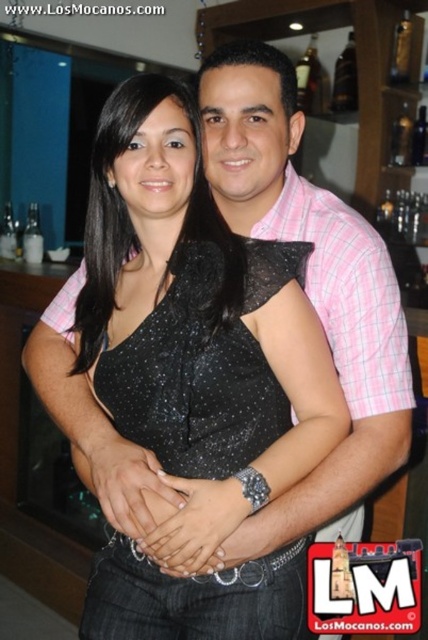
Who is more distant from viewer, (270, 435) or (297, 88)?

The point (297, 88) is more distant.

Can you confirm if black sequined dress at center is smaller than dark brown glass bottle at upper center?

Incorrect, black sequined dress at center is not smaller in size than dark brown glass bottle at upper center.

Which is behind, point (204, 204) or point (314, 104)?

The point (314, 104) is more distant.

Locate an element on the screen. The image size is (428, 640). black sequined dress at center is located at coordinates (199, 324).

Between point (308, 248) and point (347, 100), which one is positioned in front?

Point (308, 248) is more forward.

Which is more to the left, black sequined dress at center or shiny glass bottle at upper right?

Positioned to the left is black sequined dress at center.

Describe the element at coordinates (199, 324) in the screenshot. I see `black sequined dress at center` at that location.

This screenshot has height=640, width=428. Identify the location of black sequined dress at center. (199, 324).

Is dark brown glass bottle at upper center smaller than shiny glass bottle at upper right?

No.

Between dark brown glass bottle at upper center and shiny glass bottle at upper right, which one has more height?

With more height is dark brown glass bottle at upper center.

Identify the location of dark brown glass bottle at upper center. Image resolution: width=428 pixels, height=640 pixels. (309, 80).